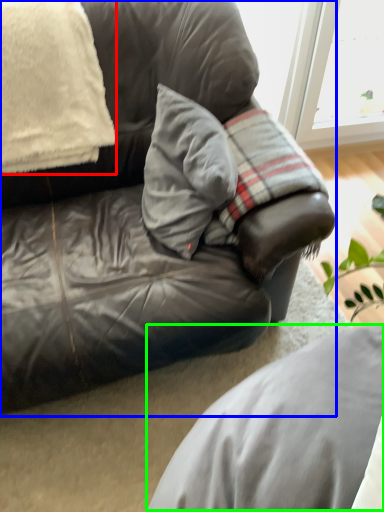
Question: Which is nearer to the pillow (highlighted by a red box)? studio couch (highlighted by a blue box) or gray (highlighted by a green box).

Choices:
 (A) studio couch
 (B) gray

Answer: (A)